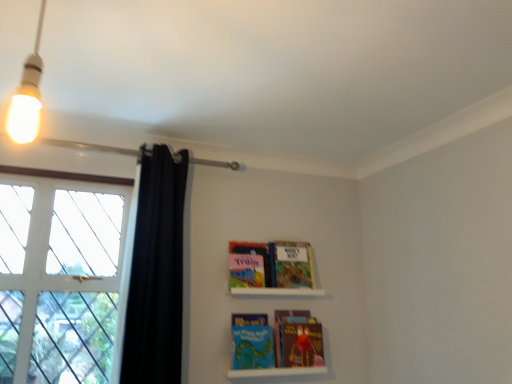
Question: Looking at the image, does matte blue book at center, which ranks as the fourth paperback book in bottom-to-top order, seem bigger or smaller compared to multicolored paper at lower center, acting as the fourth paperback book starting from the top?

Choices:
 (A) big
 (B) small

Answer: (B)

Question: Is matte blue book at center, which ranks as the fourth paperback book in bottom-to-top order, inside or outside of multicolored paper at lower center, acting as the fourth paperback book starting from the top?

Choices:
 (A) outside
 (B) inside

Answer: (A)

Question: Estimate the real-world distances between objects in this image. Which object is farther from the multicolored paper at lower center, acting as the fourth paperback book starting from the top?

Choices:
 (A) hardcover book at upper center, which is counted as the second paperback book, starting from the top
 (B) blue matte paperback book at center, arranged as the third paperback book when viewed from the top
 (C) white matte shelf at upper center, which is the 1th shelf from top to bottom
 (D) black fabric curtain at left
 (E) white glass window at left

Answer: (E)

Question: Which object is positioned farthest from the white glass window at left?

Choices:
 (A) matte plastic books at lower center, placed as the second shelf when sorted from top to bottom
 (B) multicolored paper at lower center, which is the first paperback book in bottom-to-top order
 (C) white matte shelf at upper center, which is the 1th shelf from top to bottom
 (D) matte blue book at center, which ranks as the fourth paperback book in bottom-to-top order
 (E) blue matte paperback book at center, arranged as the third paperback book when viewed from the top

Answer: (B)